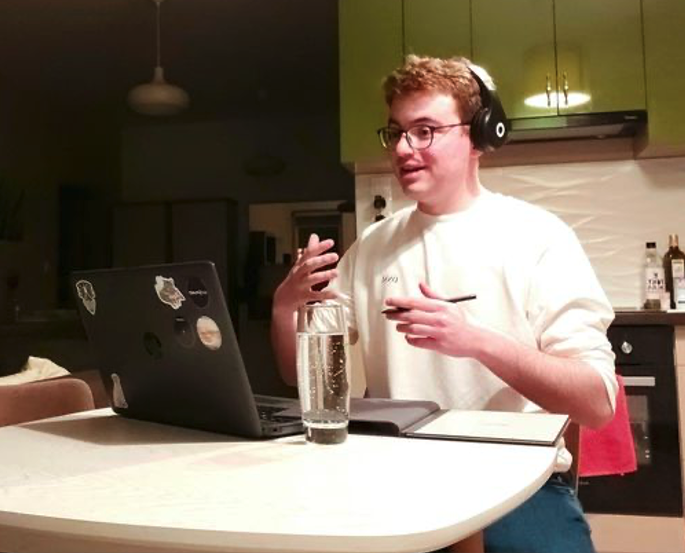
The image size is (685, 553). Find the location of `bottle`. bottle is located at coordinates (647, 297), (666, 273).